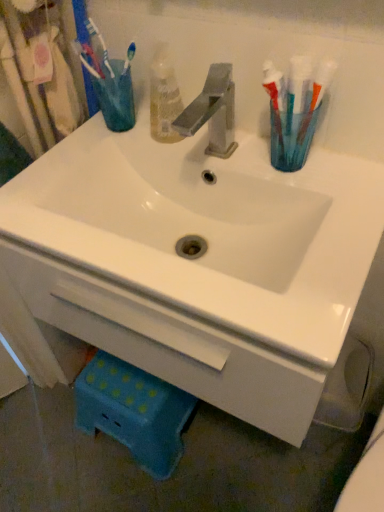
Question: Should I look upward or downward to see translucent plastic cup at upper left, which is the 1th turquoise in left-to-right order?

Choices:
 (A) up
 (B) down

Answer: (A)

Question: Are translucent plastic toothbrush holder at upper right, positioned as the second turquoise in top-to-bottom order, and translucent plastic cup at upper left, which is the second turquoise in right-to-left order, located far from each other?

Choices:
 (A) no
 (B) yes

Answer: (A)

Question: Is translucent plastic toothbrush holder at upper right, which is the second turquoise from left to right, directly adjacent to translucent plastic cup at upper left, which is counted as the 1th turquoise, starting from the back?

Choices:
 (A) no
 (B) yes

Answer: (A)

Question: Is translucent plastic toothbrush holder at upper right, which ranks as the 2th turquoise in back-to-front order, thinner than translucent plastic cup at upper left, which is counted as the 1th turquoise, starting from the back?

Choices:
 (A) yes
 (B) no

Answer: (A)

Question: Considering the relative sizes of translucent plastic toothbrush holder at upper right, the first turquoise positioned from the right, and translucent plastic cup at upper left, which is the second turquoise in right-to-left order, in the image provided, is translucent plastic toothbrush holder at upper right, the first turquoise positioned from the right, smaller than translucent plastic cup at upper left, which is the second turquoise in right-to-left order,?

Choices:
 (A) yes
 (B) no

Answer: (A)

Question: Considering the relative sizes of translucent plastic toothbrush holder at upper right, which appears as the first turquoise when ordered from the bottom, and translucent plastic cup at upper left, the 2th turquoise ordered from the bottom, in the image provided, is translucent plastic toothbrush holder at upper right, which appears as the first turquoise when ordered from the bottom, wider than translucent plastic cup at upper left, the 2th turquoise ordered from the bottom,?

Choices:
 (A) yes
 (B) no

Answer: (B)

Question: From the image's perspective, is translucent plastic toothbrush holder at upper right, which appears as the first turquoise when ordered from the bottom, below translucent plastic cup at upper left, which is counted as the 1th turquoise, starting from the back?

Choices:
 (A) yes
 (B) no

Answer: (A)

Question: Does white glossy sink at center have a lesser width compared to translucent plastic toothbrush holder at upper right, which ranks as the 2th turquoise in back-to-front order?

Choices:
 (A) yes
 (B) no

Answer: (B)

Question: From a real-world perspective, is white glossy sink at center positioned under translucent plastic toothbrush holder at upper right, which is counted as the first turquoise, starting from the front, based on gravity?

Choices:
 (A) yes
 (B) no

Answer: (A)

Question: Does white glossy sink at center have a greater height compared to translucent plastic toothbrush holder at upper right, which is the second turquoise from left to right?

Choices:
 (A) no
 (B) yes

Answer: (B)

Question: Could you tell me if white glossy sink at center is turned towards translucent plastic toothbrush holder at upper right, the first turquoise positioned from the right?

Choices:
 (A) no
 (B) yes

Answer: (A)

Question: Considering the relative positions of white glossy sink at center and translucent plastic toothbrush holder at upper right, which is the second turquoise from left to right, in the image provided, is white glossy sink at center in front of translucent plastic toothbrush holder at upper right, which is the second turquoise from left to right,?

Choices:
 (A) yes
 (B) no

Answer: (A)

Question: From a real-world perspective, does white glossy sink at center stand above translucent plastic toothbrush holder at upper right, which is counted as the first turquoise, starting from the front?

Choices:
 (A) no
 (B) yes

Answer: (A)

Question: Is translucent plastic cup at upper left, arranged as the 1th turquoise when viewed from the top, touching white glossy sink at center?

Choices:
 (A) no
 (B) yes

Answer: (A)